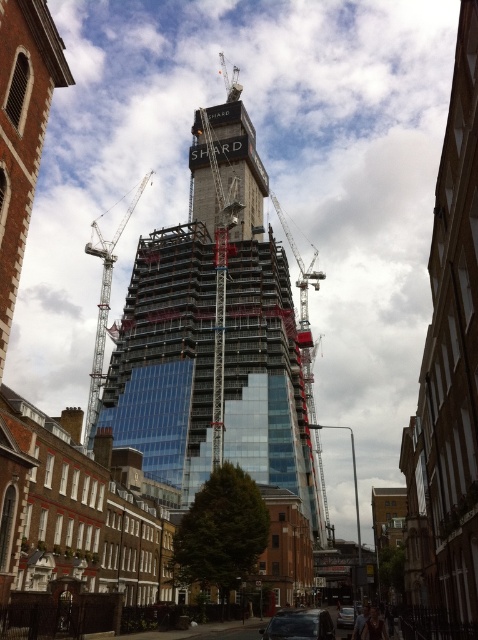
Which is behind, point (275, 200) or point (85, 444)?

Positioned behind is point (275, 200).

How distant is metallic gray crane at center from metallic gray crane at left?

The distance of metallic gray crane at center from metallic gray crane at left is 140.18 feet.

Which is behind, point (297, 324) or point (104, 305)?

Point (297, 324)

Identify the location of metallic gray crane at center. (x=304, y=312).

Does point (282, 339) lie behind point (310, 400)?

No.

Is point (267, 422) closer to viewer compared to point (326, 513)?

Yes, point (267, 422) is in front of point (326, 513).

Is point (283, 260) positioned in front of point (307, 371)?

That is True.

In order to click on glassy steel tower at center in this screenshot , I will do `click(216, 333)`.

Which is above, metallic gray crane at left or metallic silver car at center?

metallic gray crane at left

Between point (105, 250) and point (347, 620), which one is positioned behind?

Point (105, 250)

You are a GUI agent. You are given a task and a screenshot of the screen. Output one action in this format:
    pyautogui.click(x=<x>, y=<y>)
    Task: Click on the metallic gray crane at left
    
    Given the screenshot: What is the action you would take?
    (105, 308)